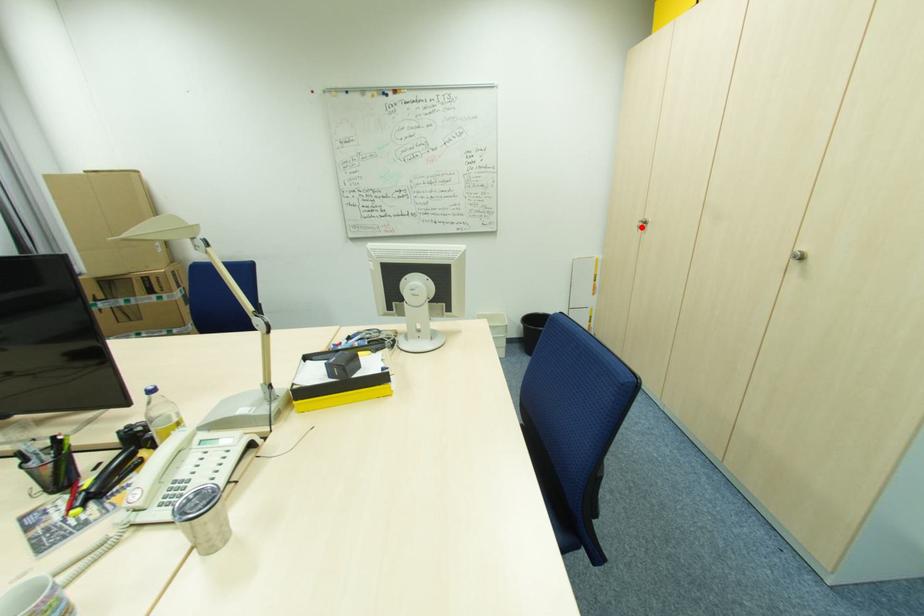
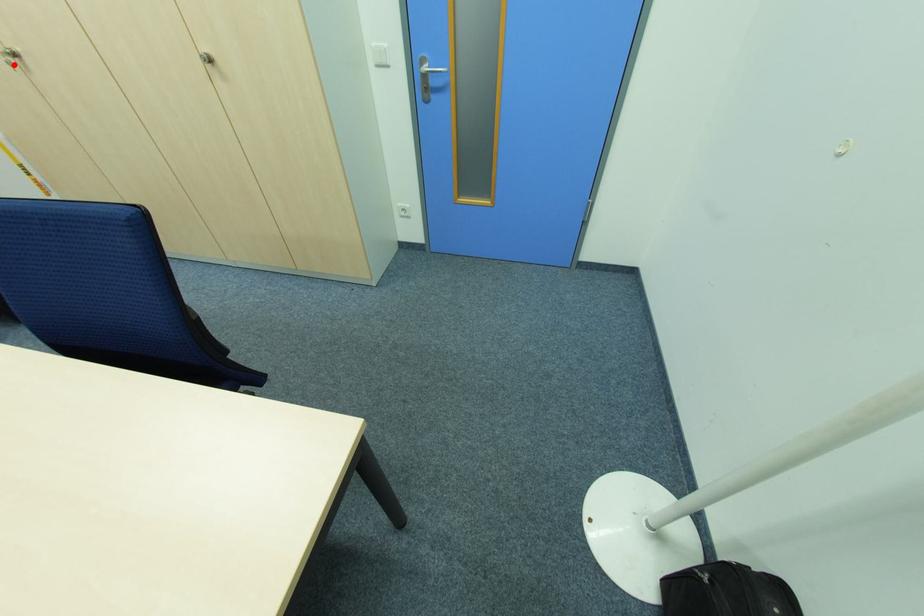
I am providing you with two images of the same scene from different viewpoints. A red point is marked on the first image and another point is marked on the second image. Is the marked point in image1 the same physical position as the marked point in image2?

Yes